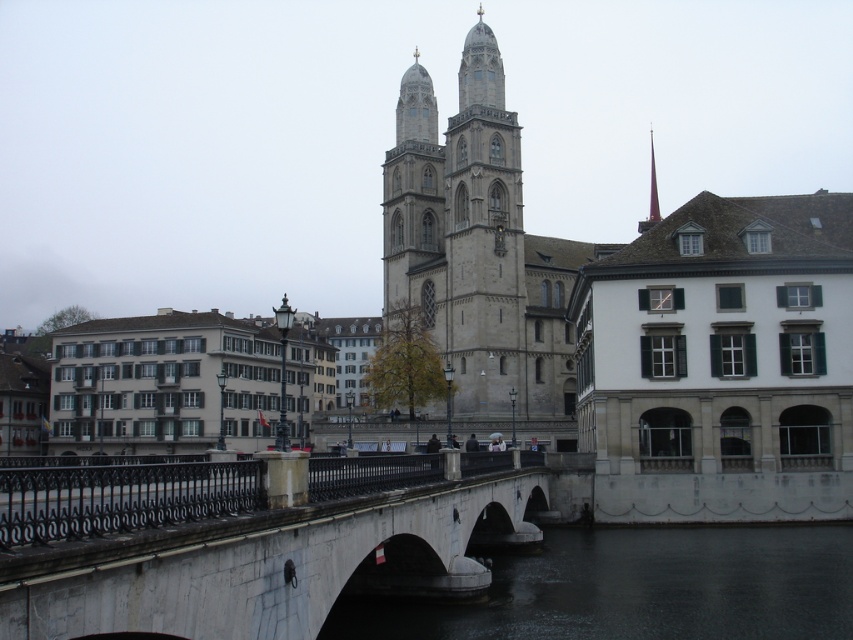
Question: Does dark gray concrete waterway at lower center come behind gray stone tower at center?

Choices:
 (A) no
 (B) yes

Answer: (A)

Question: Is dark gray concrete waterway at lower center positioned at the back of gray stone tower at center?

Choices:
 (A) yes
 (B) no

Answer: (B)

Question: Which object is the farthest from the smooth stone bridge at center?

Choices:
 (A) smooth gray spire at upper center
 (B) matte gray building at left
 (C) dark gray concrete waterway at lower center
 (D) gray stone tower at center

Answer: (A)

Question: Can you confirm if smooth stone bridge at center is positioned to the left of dark gray concrete waterway at lower center?

Choices:
 (A) no
 (B) yes

Answer: (B)

Question: Which of the following is the farthest from the observer?

Choices:
 (A) (245, 419)
 (B) (654, 192)
 (C) (375, 502)

Answer: (B)

Question: Estimate the real-world distances between objects in this image. Which object is closer to the dark gray concrete waterway at lower center?

Choices:
 (A) gray stone tower at center
 (B) matte gray building at left
 (C) smooth gray spire at upper center

Answer: (A)